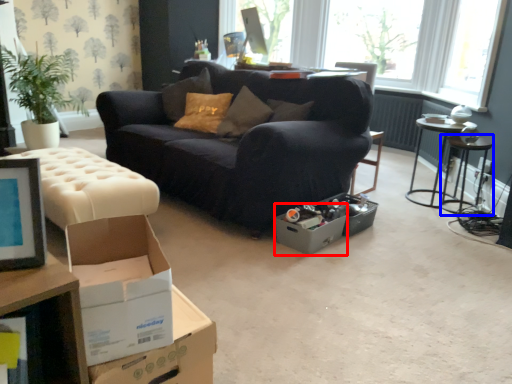
Question: Among these objects, which one is nearest to the camera, cardboard box (highlighted by a red box) or side table (highlighted by a blue box)?

Choices:
 (A) cardboard box
 (B) side table

Answer: (A)